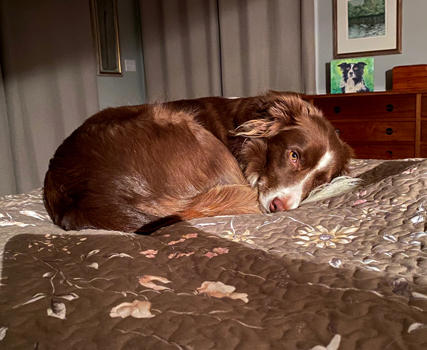
Where is `quilt`? quilt is located at coordinates (368, 248).